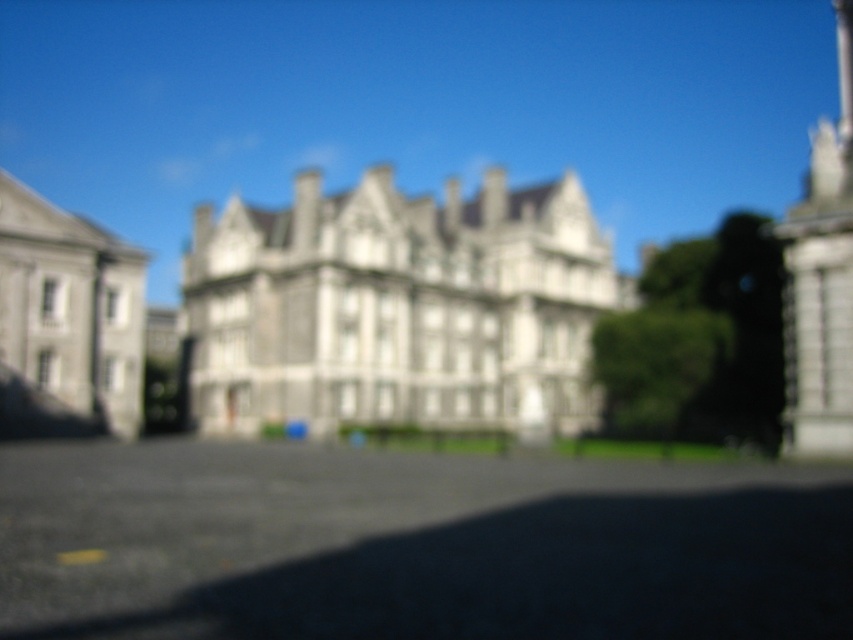
Question: Which point is closer to the camera taking this photo?

Choices:
 (A) (140, 326)
 (B) (201, 296)

Answer: (A)

Question: Does white stone building at center have a lesser width compared to gray stone building at left?

Choices:
 (A) no
 (B) yes

Answer: (A)

Question: Can you confirm if white stone building at center is positioned above gray stone building at left?

Choices:
 (A) no
 (B) yes

Answer: (B)

Question: Is the position of white stone building at center more distant than that of gray stone building at left?

Choices:
 (A) no
 (B) yes

Answer: (B)

Question: Which point is farther to the camera?

Choices:
 (A) tap(19, 275)
 (B) tap(454, 211)

Answer: (B)

Question: Which object appears farthest from the camera in this image?

Choices:
 (A) white stone building at center
 (B) gray stone building at left

Answer: (A)